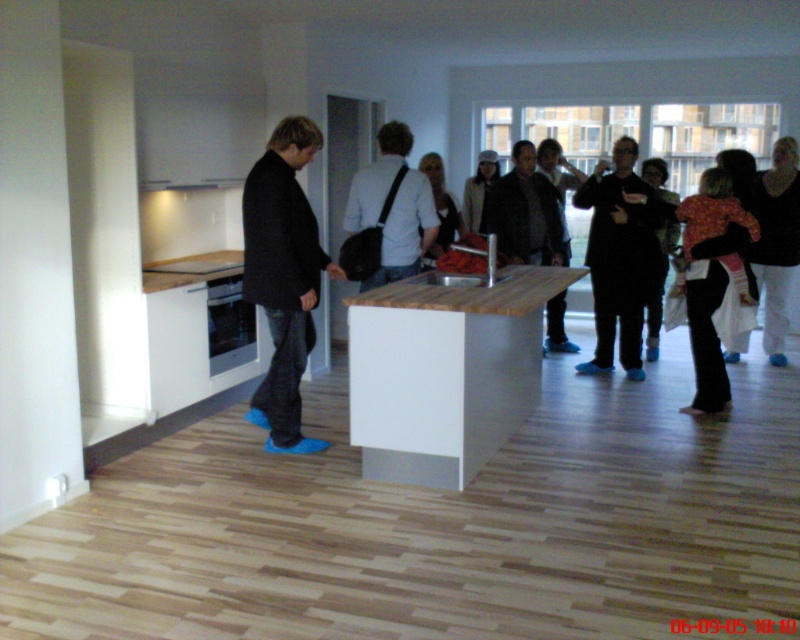
You are at a social gathering in the apartment and need to move from the dark brown leather jacket at center to the floral fabric dress at right. Which direction should you move to reach it?

To reach the floral fabric dress at right from the dark brown leather jacket at center, you should move to the right since the floral fabric dress at right is positioned to the right of the dark brown leather jacket at center.

In the scene shown: You are organizing a coat rack for guests. You have two coats to hang next to each other on a rack that can only accommodate a total width of 1.2 meters. The dark wool coat at left and the black matte coat at center are both available. Can both coats fit on the rack together?

The dark wool coat at left is narrower than the black matte coat at center. Since their combined width must be under 1.2 meters, but we don not know their exact widths, it depends on their individual measurements. However, since the dark wool coat is narrower, there is a higher likelihood they can fit together if their total width is under 1.2 meters.